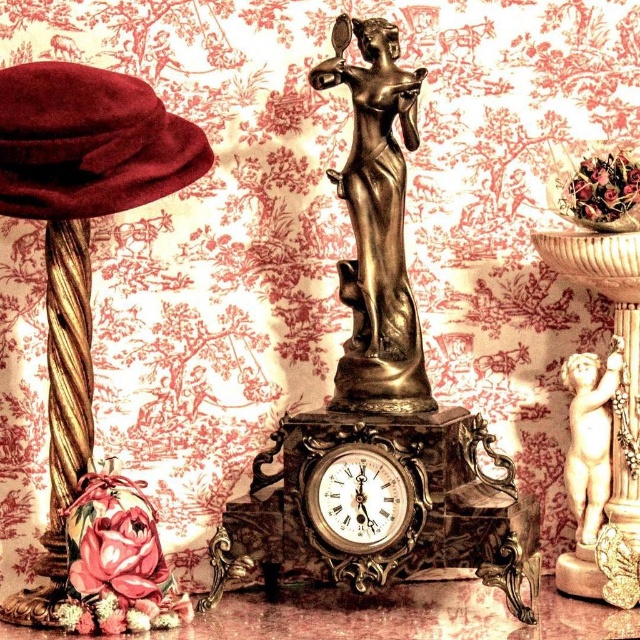
Does velvet maroon hat at left appear on the left side of smooth beige cherub at right?

Indeed, velvet maroon hat at left is positioned on the left side of smooth beige cherub at right.

Is point (58, 173) closer to camera compared to point (577, 538)?

Yes, it is.

In order to click on velvet maroon hat at left in this screenshot , I will do `click(88, 328)`.

Which is above, velvet maroon hat at left or bronze statue at center?

bronze statue at center is higher up.

Does point (67, 164) come in front of point (374, 221)?

Yes, it is.

At what (x,y) coordinates should I click in order to perform the action: click on velvet maroon hat at left. Please return your answer as a coordinate pair (x, y). The height and width of the screenshot is (640, 640). Looking at the image, I should click on [88, 328].

Identify the location of velvet maroon hat at left. The width and height of the screenshot is (640, 640). 88,328.

Does gold-toned metal clock at center come behind smooth beige cherub at right?

That is False.

Does gold-toned metal clock at center appear on the right side of smooth beige cherub at right?

In fact, gold-toned metal clock at center is to the left of smooth beige cherub at right.

What do you see at coordinates (360, 499) in the screenshot?
I see `gold-toned metal clock at center` at bounding box center [360, 499].

Find the location of a particular element. gold-toned metal clock at center is located at coordinates (360, 499).